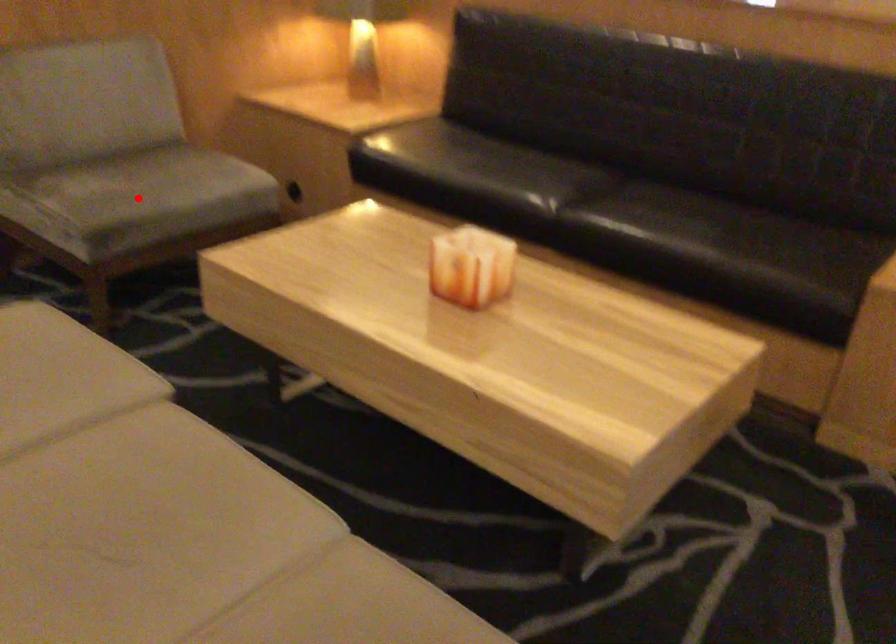
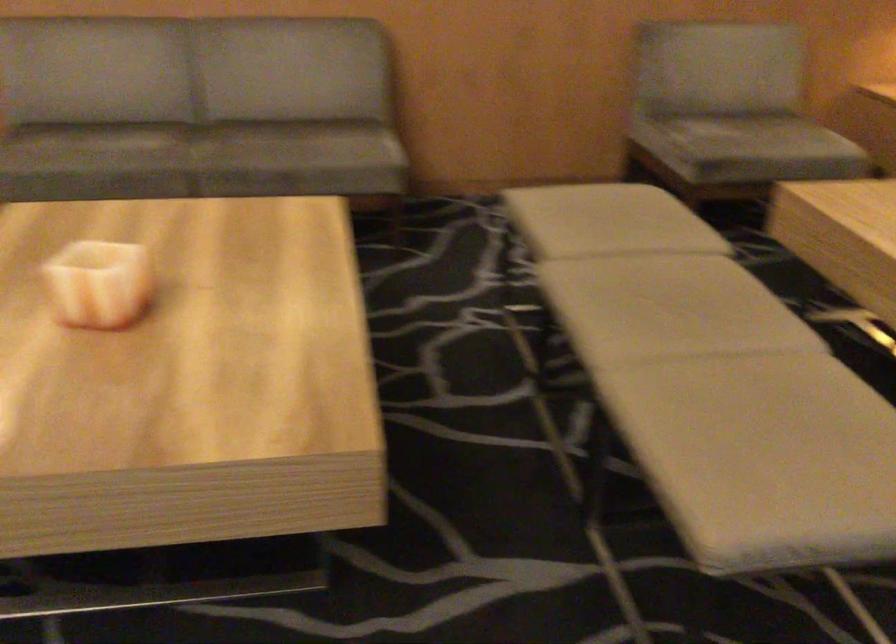
The point at the highlighted location is marked in the first image. Where is the corresponding point in the second image?

(744, 138)